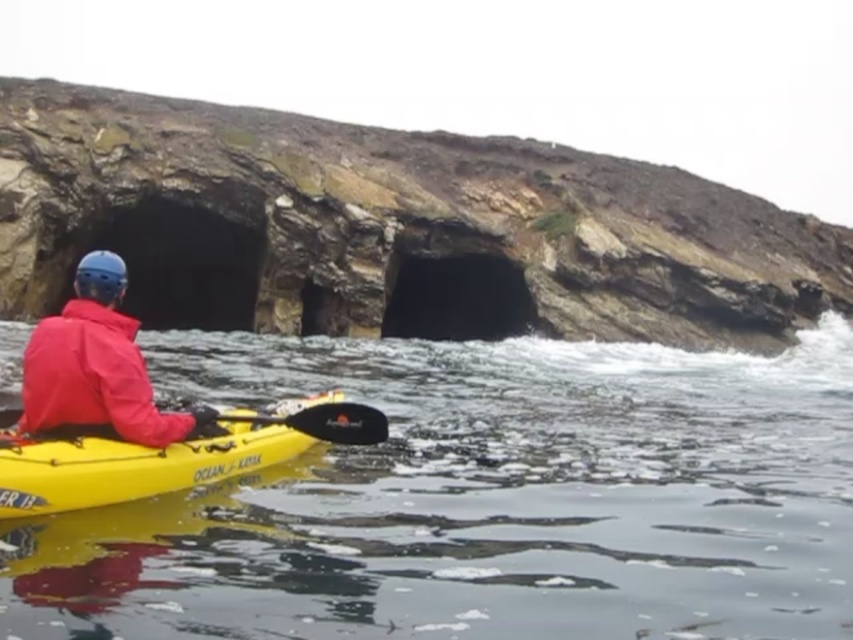
Question: Does clear water at lower center appear under black rubber paddle at center?

Choices:
 (A) no
 (B) yes

Answer: (A)

Question: Among these objects, which one is farthest from the camera?

Choices:
 (A) matte red jacket at center
 (B) clear water at lower center
 (C) yellow plastic kayak at lower left
 (D) black rubber paddle at center

Answer: (A)

Question: Is clear water at lower center below matte red jacket at center?

Choices:
 (A) yes
 (B) no

Answer: (A)

Question: Which of the following is the closest to the observer?

Choices:
 (A) matte red jacket at center
 (B) yellow plastic kayak at lower left

Answer: (B)

Question: Which is nearer to the black rubber paddle at center?

Choices:
 (A) matte red jacket at center
 (B) yellow plastic kayak at lower left
 (C) clear water at lower center

Answer: (B)

Question: Considering the relative positions of matte red jacket at center and yellow plastic kayak at lower left in the image provided, where is matte red jacket at center located with respect to yellow plastic kayak at lower left?

Choices:
 (A) left
 (B) right

Answer: (A)